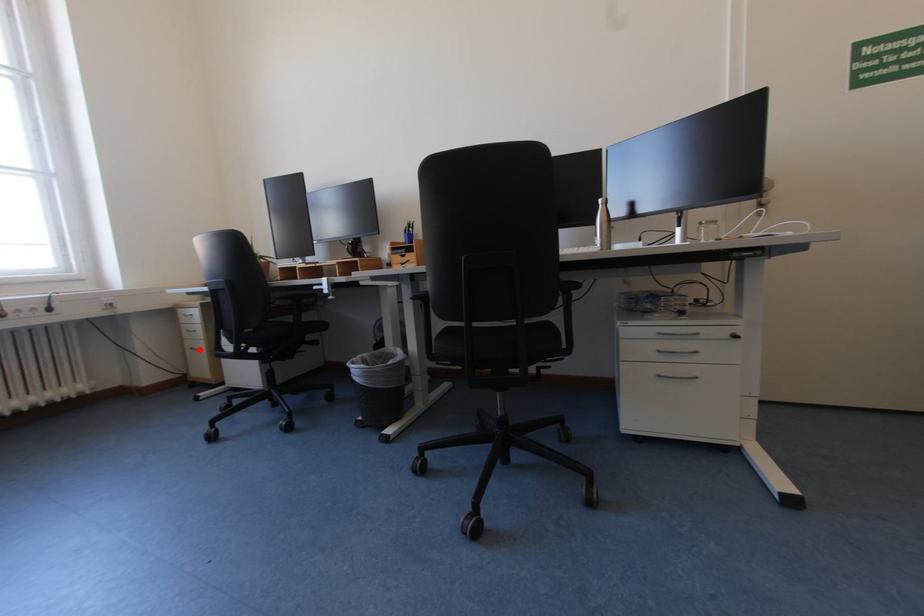
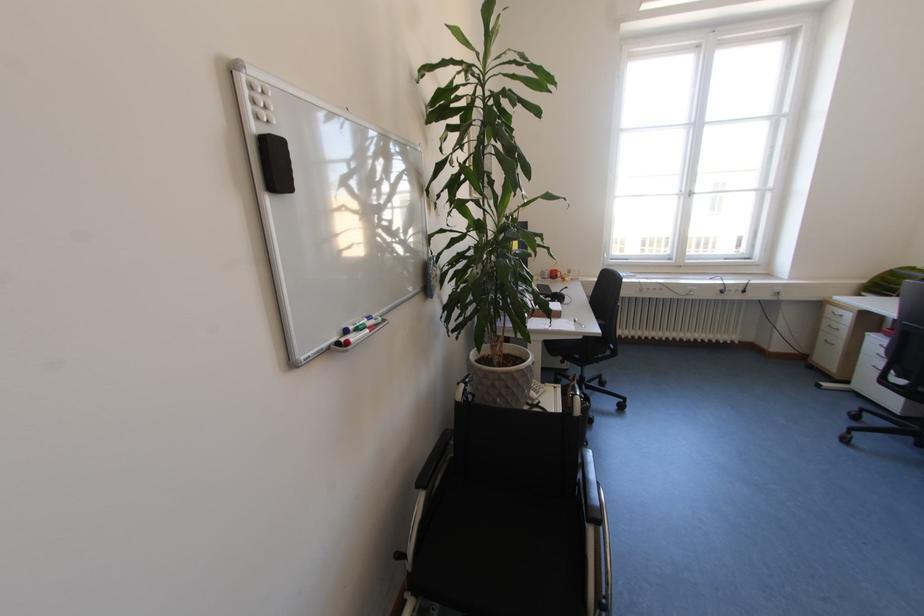
Where in the second image is the point corresponding to the highlighted location from the first image?

(833, 342)